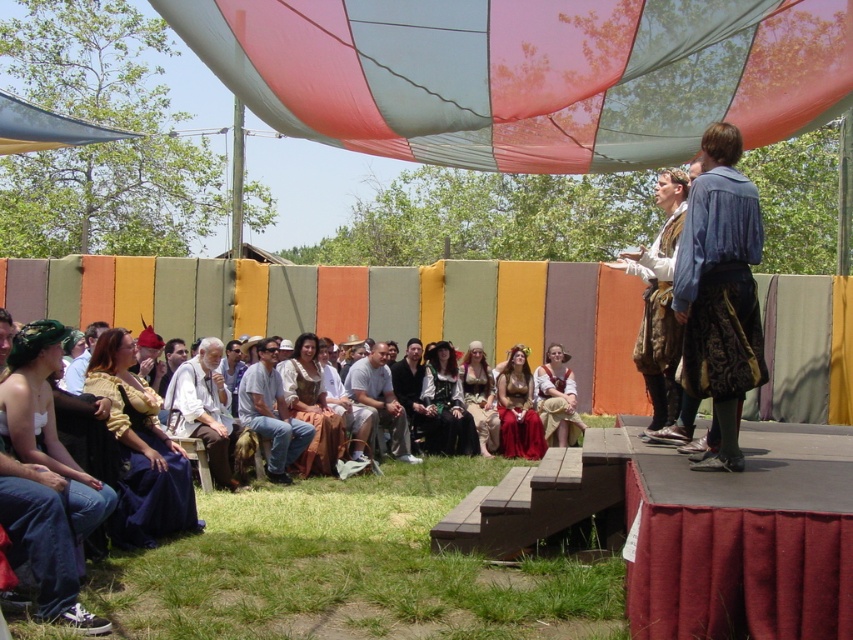
You are standing at the center of the stage looking towards the audience. Which direction should you move to face the matte yellow dress at lower left?

Since the matte yellow dress at lower left is located at point (140, 451), which is in the lower left area of the image, you should move towards the lower left direction to face it.

You are a photographer at the event and want to capture a photo of the matte yellow dress at lower left and the matte brown hat at center. Based on their positions, which object should you focus on first to ensure both are in frame?

The matte yellow dress at lower left should be focused on first since it is positioned below the matte brown hat at center, ensuring both are within the camera frame.

You are a performer preparing to exit the stage and need to pass through the area where the matte brown dress at upper right and the matte brown leather jacket at lower left are located. Which direction should you move to avoid stepping on either of them?

To avoid stepping on either the matte brown dress at upper right or the matte brown leather jacket at lower left, you should move in a direction away from both. Since the matte brown dress at upper right is in front of the matte brown leather jacket at lower left, moving sideways or backward would keep you clear of both objects.